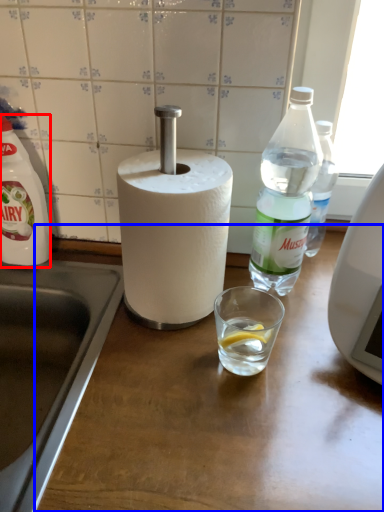
Question: Which of the following is the closest to the observer, bottle (highlighted by a red box) or counter top (highlighted by a blue box)?

Choices:
 (A) bottle
 (B) counter top

Answer: (B)